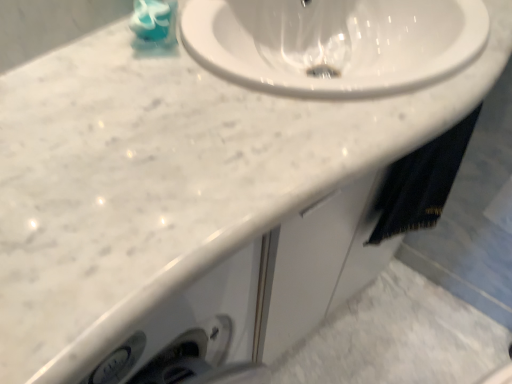
Where is `spots to the right of teal glossy soap at upper left`? This screenshot has height=384, width=512. spots to the right of teal glossy soap at upper left is located at coordinates (239, 64).